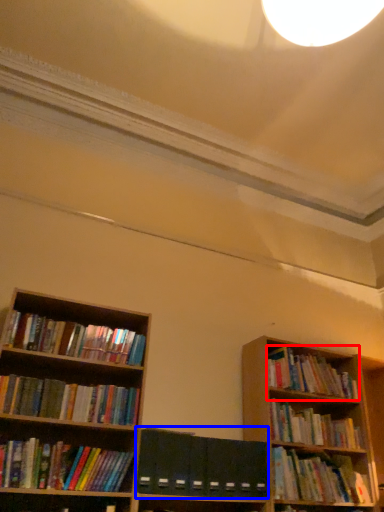
Question: Which object is closer to the camera taking this photo, book (highlighted by a red box) or paperback book (highlighted by a blue box)?

Choices:
 (A) book
 (B) paperback book

Answer: (B)